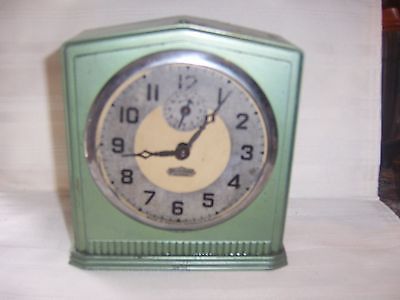
I want to click on white wall, so click(36, 17), click(316, 15).